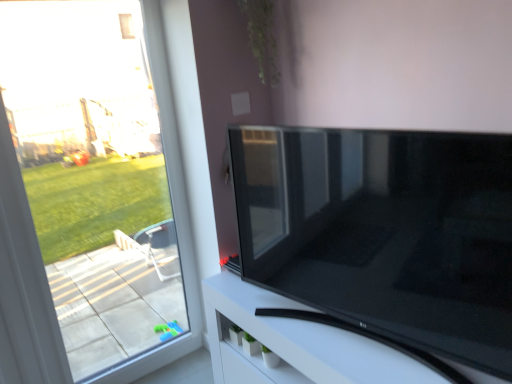
This screenshot has height=384, width=512. What are the coordinates of `vacant area situated below matte black tv at center (from a real-world perspective)` in the screenshot? It's located at (346, 332).